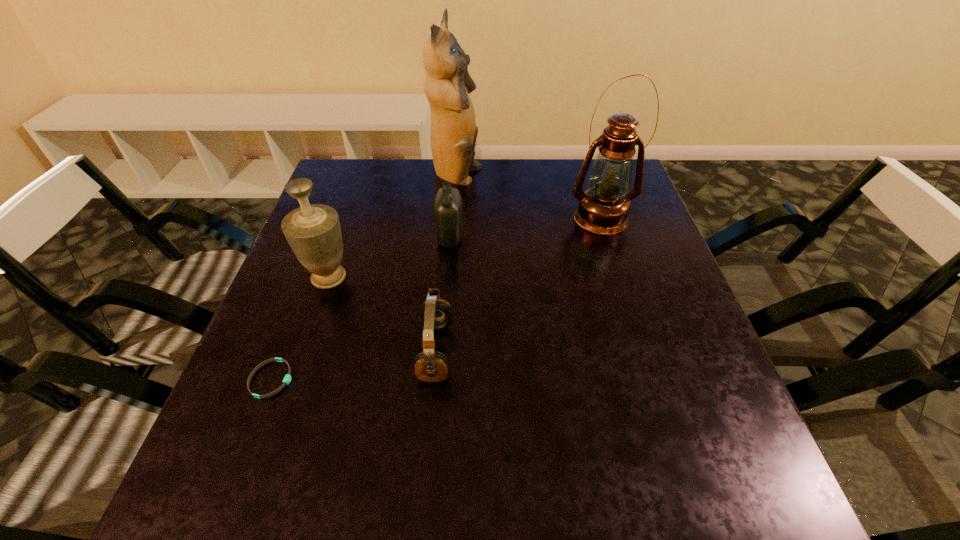
Where is `vacant space at the far edge of the desktop`? This screenshot has width=960, height=540. vacant space at the far edge of the desktop is located at coordinates (537, 178).

Locate an element on the screen. The image size is (960, 540). free space at the near edge of the desktop is located at coordinates (635, 472).

In the image, there is a desktop. At what (x,y) coordinates should I click in order to perform the action: click on vacant space at the left edge. Please return your answer as a coordinate pair (x, y). This screenshot has height=540, width=960. Looking at the image, I should click on (333, 362).

Locate an element on the screen. free space at the right edge is located at coordinates (683, 446).

At what (x,y) coordinates should I click in order to perform the action: click on blank space at the far left corner of the desktop. Please return your answer as a coordinate pair (x, y). The width and height of the screenshot is (960, 540). Looking at the image, I should click on (326, 188).

This screenshot has width=960, height=540. Identify the location of vacant region between the headset and the urn. (382, 315).

Identify the location of empty space that is in between the fifth tallest object and the shortest object. The height and width of the screenshot is (540, 960). (353, 366).

You are a GUI agent. You are given a task and a screenshot of the screen. Output one action in this format:
    pyautogui.click(x=<x>, y=<y>)
    Task: Click on the vacant space that's between the bottle and the rightmost object
    The width and height of the screenshot is (960, 540).
    Given the screenshot: What is the action you would take?
    pyautogui.click(x=525, y=227)

Where is `vacant area that lies between the bottle and the wristband`? The height and width of the screenshot is (540, 960). vacant area that lies between the bottle and the wristband is located at coordinates (361, 308).

At what (x,y) coordinates should I click in order to perform the action: click on vacant area that lies between the fourth tallest object and the oil lamp. Please return your answer as a coordinate pair (x, y). The height and width of the screenshot is (540, 960). Looking at the image, I should click on (525, 227).